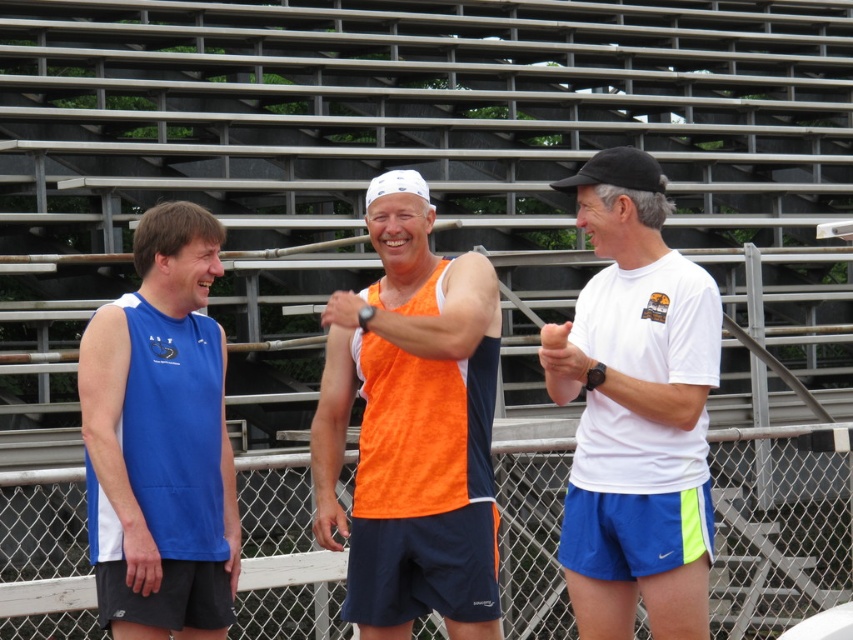
Based on the photo, is orange fabric tank top at center above blue sleeveless shirt at left?

Yes.

Does orange fabric tank top at center lie behind blue sleeveless shirt at left?

Yes.

This screenshot has height=640, width=853. I want to click on orange fabric tank top at center, so click(412, 426).

Which of these two, orange fabric tank top at center or white matte t-shirt at center, stands shorter?

Standing shorter between the two is orange fabric tank top at center.

Is point (384, 419) positioned before point (601, 349)?

Yes, it is.

What are the coordinates of `orange fabric tank top at center` in the screenshot? It's located at (412, 426).

Does white matte t-shirt at center appear under blue sleeveless shirt at left?

Incorrect, white matte t-shirt at center is not positioned below blue sleeveless shirt at left.

Who is more forward, (612, 572) or (142, 592)?

Point (142, 592)

Find the location of a particular element. The image size is (853, 640). white matte t-shirt at center is located at coordinates (635, 410).